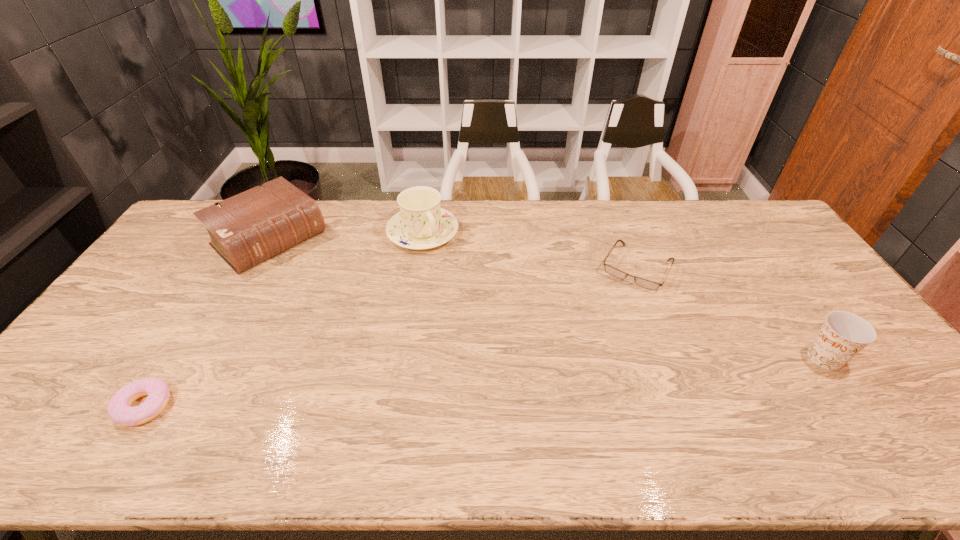
You are a GUI agent. You are given a task and a screenshot of the screen. Output one action in this format:
    pyautogui.click(x=<x>, y=<y>)
    Task: Click on the vacant spot on the desktop that is between the nearest object and the Dixie cup and is positioned on the handle side of the third object from right to left
    This screenshot has height=540, width=960.
    Given the screenshot: What is the action you would take?
    pyautogui.click(x=530, y=379)

Find the location of a particular element. free space on the desktop that is between the nearest object and the fourth farthest object and is positioned on the front-facing side of the fourth object from left to right is located at coordinates (577, 375).

You are a GUI agent. You are given a task and a screenshot of the screen. Output one action in this format:
    pyautogui.click(x=<x>, y=<y>)
    Task: Click on the vacant space on the desktop that is between the nearest object and the rightmost object and is positioned on the spine side of the Bible
    Image resolution: width=960 pixels, height=540 pixels.
    Given the screenshot: What is the action you would take?
    pyautogui.click(x=429, y=386)